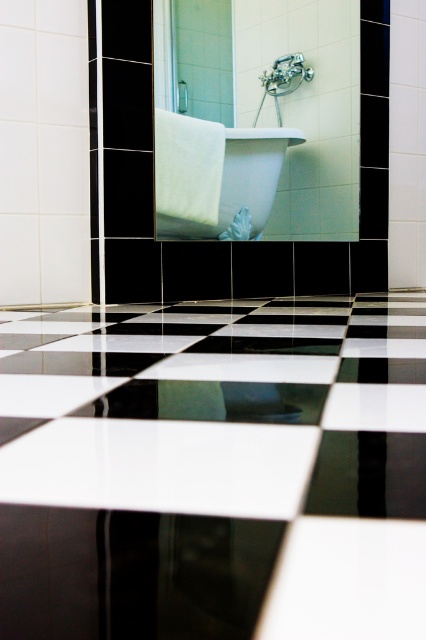
You are standing in the bathroom shown in the image. There is a point marked at coordinates (x=215, y=177). What object is located at that point?

The point at coordinates (x=215, y=177) marks the white glossy bathtub at center.

You are standing in the bathroom and want to place a new plant pot exactly at the center of the bathroom. The bathroom has a black and white checkered floor. Where should you place the plant pot relative to the white glossy bathtub at center?

The white glossy bathtub at center is located at point (215,177), so the center of the bathroom would be at the geometric center of the checkered floor. Since the bathtub is slightly offset from the center coordinates, you should place the plant pot at the true center of the floor, which is different from the bathtub position.